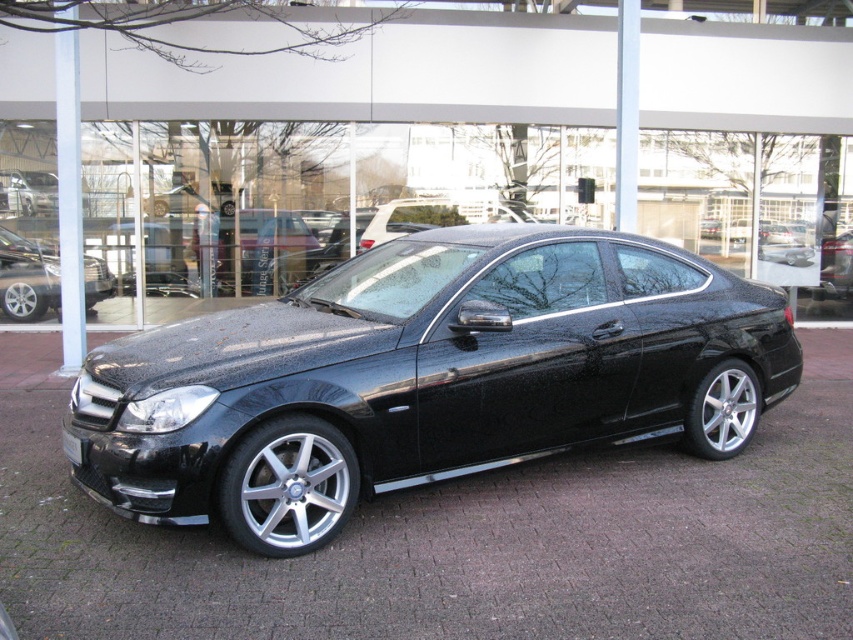
In the scene shown: You are standing at a crosswalk waiting to cross the street. You see the shiny metallic car at center parked outside a modern building. If the crosswalk is 15 meters long, can you safely cross before the car moves forward 5 meters towards you?

The shiny metallic car at center and viewer are 10.71 meters apart. If the car moves forward 5 meters, it will be 5.71 meters away from you. Since the crosswalk is 15 meters long, you have enough time to cross safely before the car reaches you.

You are a photographer trying to capture a closeup of the black glossy license plate at front without the black metallic car at center blocking the shot. Is it possible to angle your camera so that the license plate is visible while avoiding the car?

The black metallic car at center is much taller than the black glossy license plate at front, so you can lower your camera angle to capture the license plate while avoiding the car.